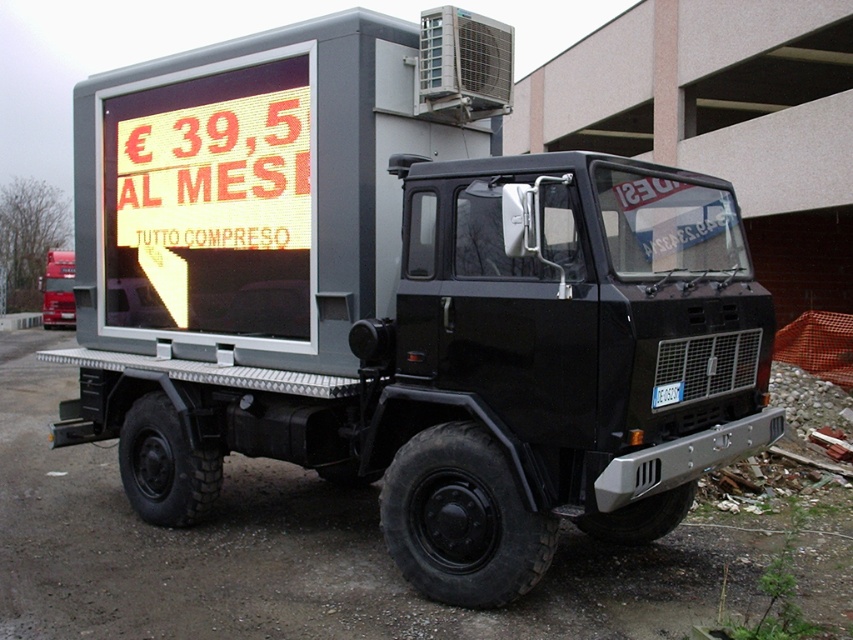
What do you see at coordinates (303, 550) in the screenshot?
I see `black rubber tire at lower center` at bounding box center [303, 550].

Does black rubber tire at lower center have a larger size compared to yellow led sign at upper left?

Yes.

Is point (183, 532) closer to camera compared to point (115, 170)?

Yes, it is in front of point (115, 170).

Where is `black rubber tire at lower center`? The image size is (853, 640). black rubber tire at lower center is located at coordinates (303, 550).

Does gray matte led display at center lie behind black rubber tire at lower center?

That is True.

In the scene shown: Can you confirm if gray matte led display at center is smaller than black rubber tire at lower center?

Yes.

Between point (335, 230) and point (817, 499), which one is positioned in front?

Positioned in front is point (335, 230).

This screenshot has height=640, width=853. Identify the location of gray matte led display at center. (251, 192).

Between gray matte led display at center and yellow led sign at upper left, which one is positioned lower?

Positioned lower is yellow led sign at upper left.

Which is behind, point (88, 180) or point (256, 196)?

The point (88, 180) is behind.

Is point (424, 60) less distant than point (200, 224)?

Yes, point (424, 60) is closer to viewer.

The width and height of the screenshot is (853, 640). In order to click on gray matte led display at center in this screenshot , I will do `click(251, 192)`.